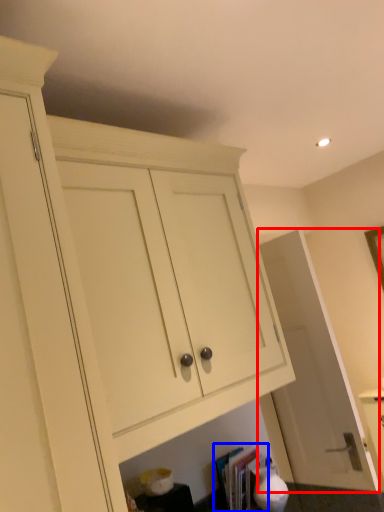
Question: Which of the following is the closest to the observer, door (highlighted by a red box) or book (highlighted by a blue box)?

Choices:
 (A) door
 (B) book

Answer: (B)